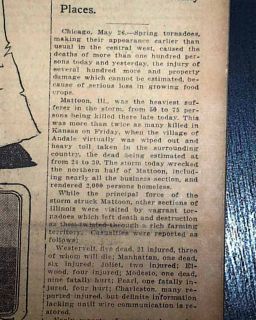
You are a GUI agent. You are given a task and a screenshot of the screen. Output one action in this format:
    pyautogui.click(x=<x>, y=<y>)
    Task: Click on the black table
    The width and height of the screenshot is (256, 320).
    Given the screenshot: What is the action you would take?
    coord(245,232)